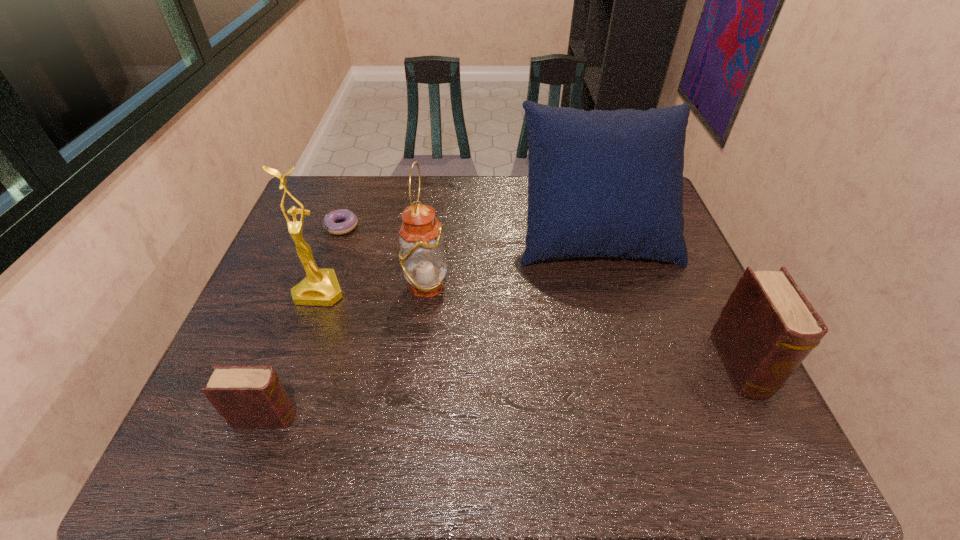
Locate an element on the screen. free location located on the right of the oil lamp is located at coordinates (538, 285).

Where is `free location located 0.060m on the facing side of the cushion`? free location located 0.060m on the facing side of the cushion is located at coordinates (610, 286).

Find the location of a particular element. The width and height of the screenshot is (960, 540). vacant space located on the front-facing side of the award is located at coordinates coord(289,379).

At what (x,y) coordinates should I click in order to perform the action: click on doughnut at the far edge. Please return your answer as a coordinate pair (x, y). Image resolution: width=960 pixels, height=540 pixels. Looking at the image, I should click on (350, 223).

Identify the location of cushion that is at the far edge. The width and height of the screenshot is (960, 540). (601, 183).

Where is `diary present at the left edge`? The width and height of the screenshot is (960, 540). diary present at the left edge is located at coordinates (248, 397).

Identify the location of doughnut that is at the left edge. (350, 223).

The image size is (960, 540). In order to click on award that is at the left edge in this screenshot , I will do `click(320, 288)`.

Find the location of a particular element. The height and width of the screenshot is (540, 960). diary that is positioned at the right edge is located at coordinates (767, 328).

This screenshot has height=540, width=960. In order to click on cushion at the right edge in this screenshot , I will do `click(601, 183)`.